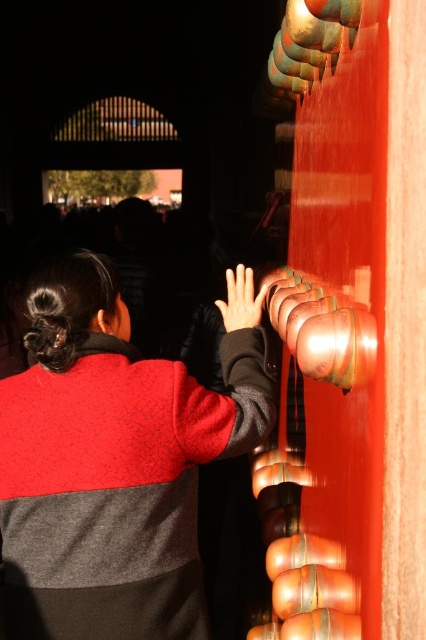
Question: Which of the following is the farthest from the observer?

Choices:
 (A) matte black hand at center
 (B) speckled wool sweater at center

Answer: (A)

Question: Which point is farther to the camera?

Choices:
 (A) (154, 380)
 (B) (242, 323)

Answer: (B)

Question: Which of the following is the farthest from the observer?

Choices:
 (A) (106, 552)
 (B) (261, 317)

Answer: (B)

Question: Is speckled wool sweater at center to the right of matte black hand at center from the viewer's perspective?

Choices:
 (A) yes
 (B) no

Answer: (B)

Question: Does speckled wool sweater at center appear on the right side of matte black hand at center?

Choices:
 (A) no
 (B) yes

Answer: (A)

Question: Considering the relative positions of speckled wool sweater at center and matte black hand at center in the image provided, where is speckled wool sweater at center located with respect to matte black hand at center?

Choices:
 (A) left
 (B) right

Answer: (A)